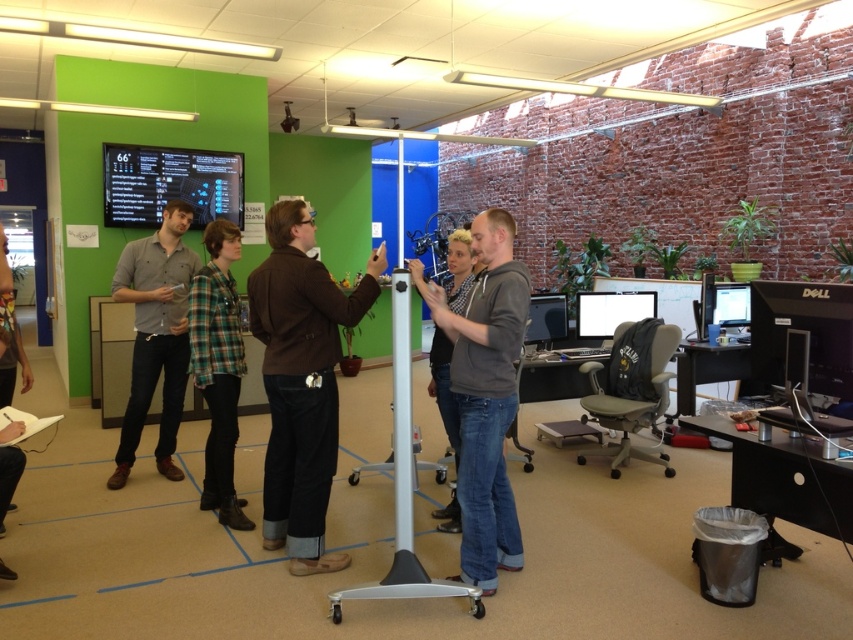
Question: Estimate the real-world distances between objects in this image. Which object is closer to the gray matte hoodie at center?

Choices:
 (A) green plaid shirt at center
 (B) matte black monitor at upper left
 (C) matte black monitor at center

Answer: (A)

Question: Does white glossy pole at center appear under matte black monitor at right?

Choices:
 (A) yes
 (B) no

Answer: (A)

Question: Does matte black monitor at upper left appear over matte black monitor at right?

Choices:
 (A) yes
 (B) no

Answer: (A)

Question: Among these objects, which one is farthest from the camera?

Choices:
 (A) brown leather jacket at center
 (B) matte black monitor at center right
 (C) matte black monitor at right

Answer: (C)

Question: Can you confirm if matte black monitor at upper left is positioned to the right of matte black monitor at center right?

Choices:
 (A) yes
 (B) no

Answer: (B)

Question: Which object is the farthest from the gray matte hoodie at center?

Choices:
 (A) matte black monitor at center
 (B) white glossy monitor at center right
 (C) matte black monitor at right
 (D) white glossy pole at center

Answer: (C)